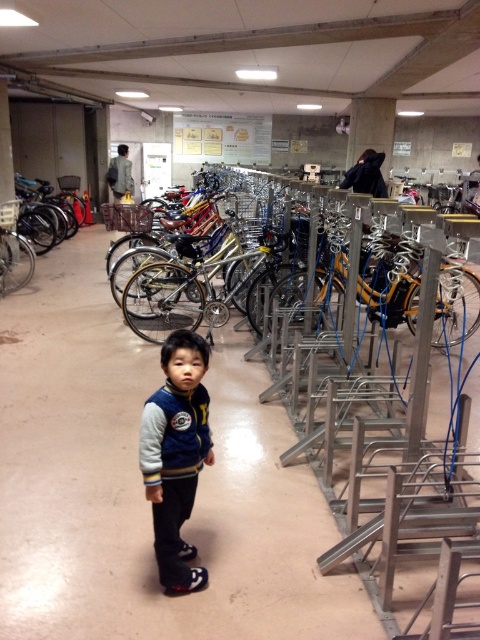
Question: Which of the following is the farthest from the observer?

Choices:
 (A) (194, 257)
 (B) (201, 339)

Answer: (A)

Question: Where is shiny metallic bicycle at center located in relation to velvet-like blue jacket at center in the image?

Choices:
 (A) below
 (B) above

Answer: (B)

Question: Observing the image, what is the correct spatial positioning of shiny metallic bicycle at center in reference to velvet-like blue jacket at center?

Choices:
 (A) above
 (B) below

Answer: (A)

Question: Is shiny metallic bicycle at center further to the viewer compared to velvet-like blue jacket at center?

Choices:
 (A) no
 (B) yes

Answer: (B)